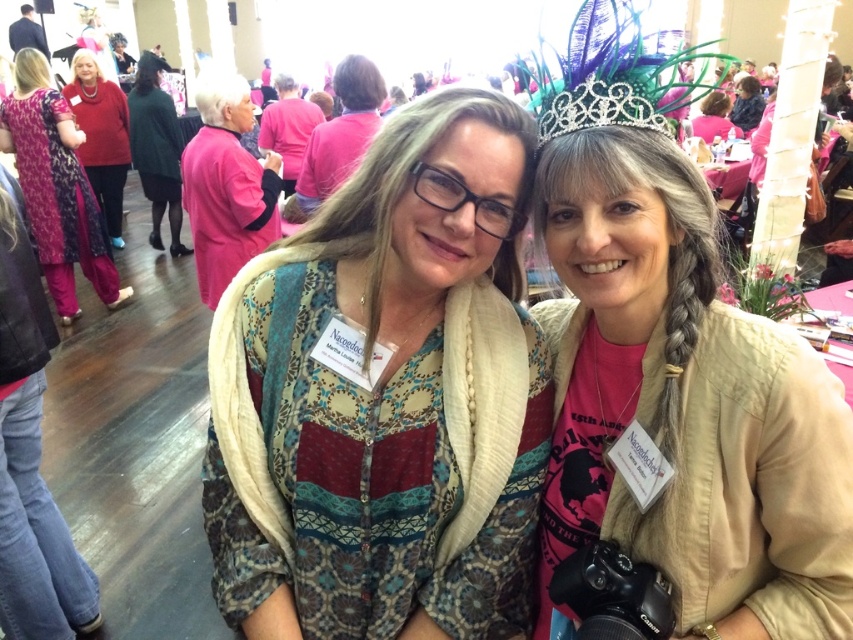
Question: Which object is closer to the camera taking this photo?

Choices:
 (A) pink satin dress at upper center
 (B) pink fabric at center

Answer: (B)

Question: Among these points, which one is farthest from the camera?

Choices:
 (A) (113, 244)
 (B) (386, 412)
 (C) (567, 104)
 (D) (583, 45)

Answer: (A)

Question: Is matte pink dress at upper left to the left of green wool sweater at upper left from the viewer's perspective?

Choices:
 (A) no
 (B) yes

Answer: (A)

Question: Can you confirm if patterned fabric scarf at center is positioned to the left of green wool sweater at upper left?

Choices:
 (A) no
 (B) yes

Answer: (A)

Question: Where is shiny silver crown at upper center located in relation to pink satin dress at upper center in the image?

Choices:
 (A) below
 (B) above

Answer: (A)

Question: Which point is farther to the camera?

Choices:
 (A) pyautogui.click(x=199, y=196)
 (B) pyautogui.click(x=817, y=608)
 (C) pyautogui.click(x=80, y=51)
 (D) pyautogui.click(x=711, y=68)

Answer: (D)